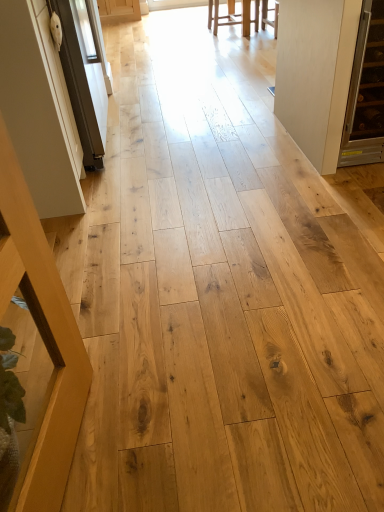
Question: Is white glossy screen door at left taller or shorter than white matte door at right?

Choices:
 (A) short
 (B) tall

Answer: (B)

Question: Is white glossy screen door at left wider or thinner than white matte door at right?

Choices:
 (A) thin
 (B) wide

Answer: (A)

Question: Which object is positioned closest to the natural wood table at left, which ranks as the first furniture in left-to-right order?

Choices:
 (A) light brown wood stool at upper center, the second furniture positioned from the bottom
 (B) white matte door at right
 (C) white glossy screen door at left

Answer: (C)

Question: Considering the real-world distances, which object is farthest from the natural wood table at left, which is counted as the first furniture, starting from the front?

Choices:
 (A) white glossy screen door at left
 (B) white matte door at right
 (C) light brown wood stool at upper center, acting as the first furniture starting from the right

Answer: (C)